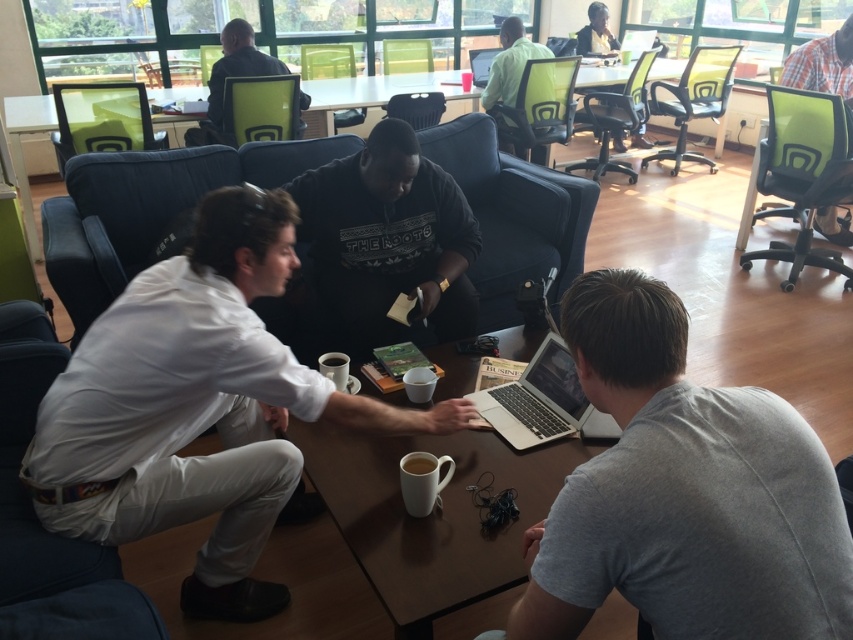
Question: Estimate the real-world distances between objects in this image. Which object is farther from the white matte shirt at center?

Choices:
 (A) gray matte shirt at lower right
 (B) white matte mug at center

Answer: (A)

Question: Which object is closer to the camera taking this photo?

Choices:
 (A) silver metallic laptop at center
 (B) white matte mug at center
 (C) black sweater at center

Answer: (B)

Question: Does wooden table at center appear on the left side of black sweater at center?

Choices:
 (A) yes
 (B) no

Answer: (B)

Question: Is matte black shirt at upper center above green matte chair at upper center?

Choices:
 (A) yes
 (B) no

Answer: (B)

Question: Which of the following is the closest to the observer?

Choices:
 (A) (234, 26)
 (B) (456, 240)
 (C) (730, 401)

Answer: (C)

Question: Does white matte shirt at center have a lesser width compared to black sweater at center?

Choices:
 (A) no
 (B) yes

Answer: (A)